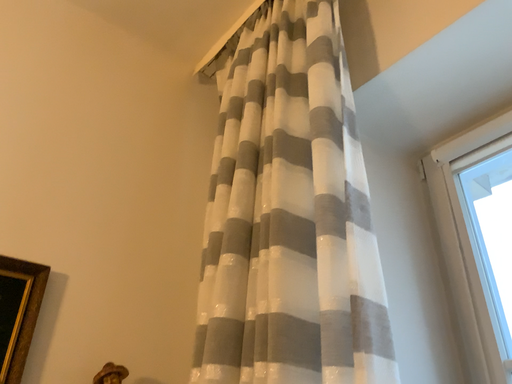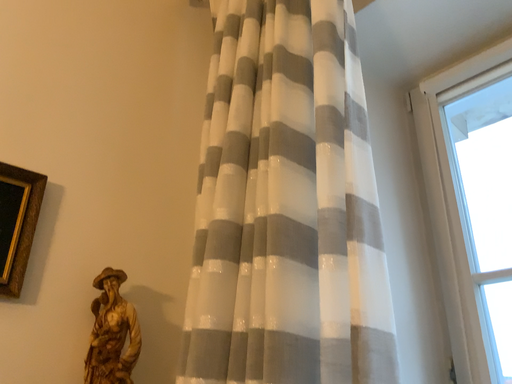
Question: How did the camera likely rotate when shooting the video?

Choices:
 (A) rotated downward
 (B) rotated upward

Answer: (A)